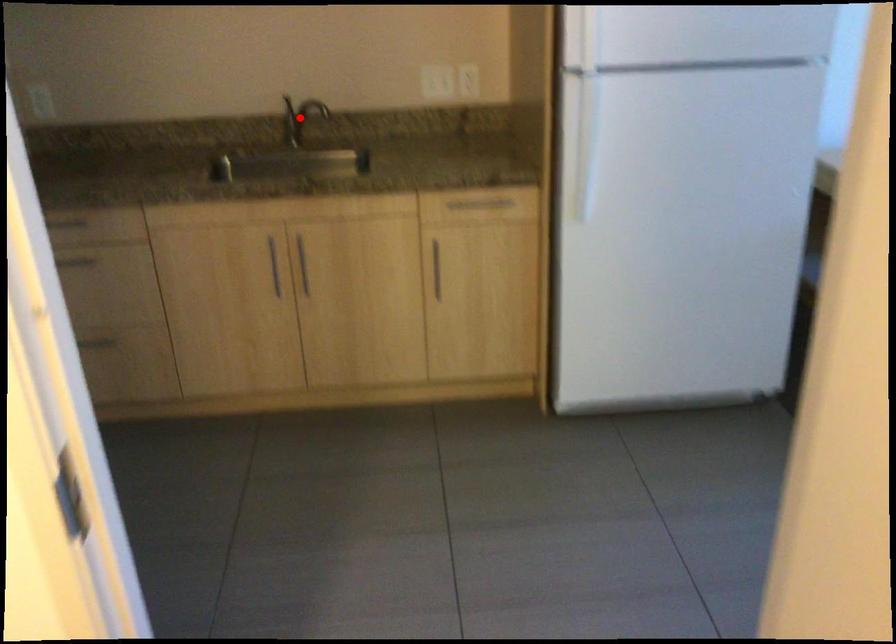
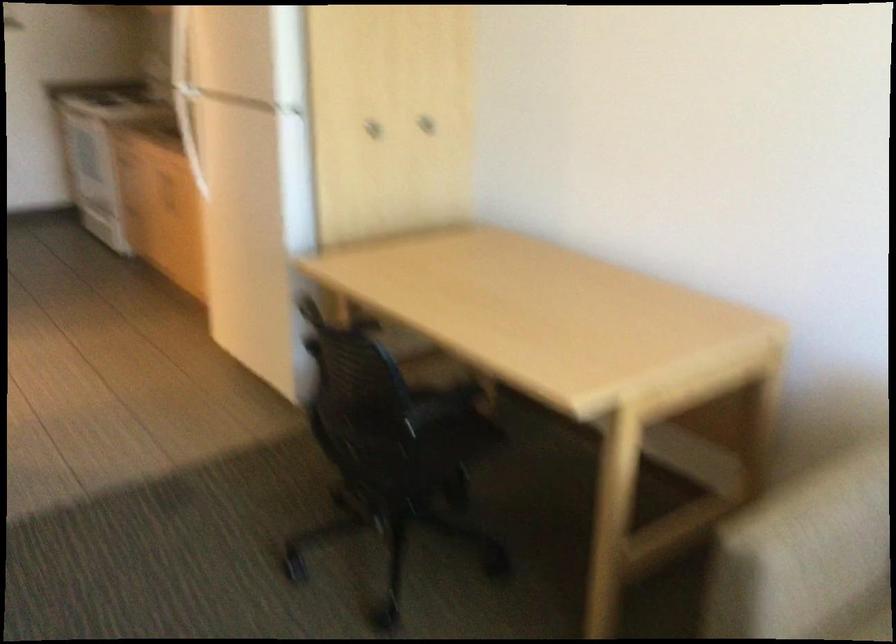
Question: I am providing you with two images of the same scene from different viewpoints. A red point is marked on the first image. Is the red point's position out of view in image 2?

Choices:
 (A) Yes
 (B) No

Answer: (A)